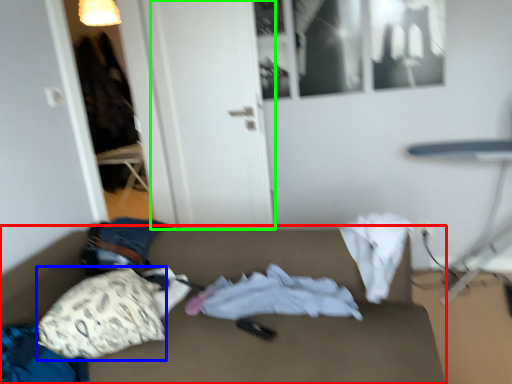
Question: Which object is the farthest from studio couch (highlighted by a red box)? Choose among these: throw pillow (highlighted by a blue box) or door (highlighted by a green box).

Choices:
 (A) throw pillow
 (B) door

Answer: (B)